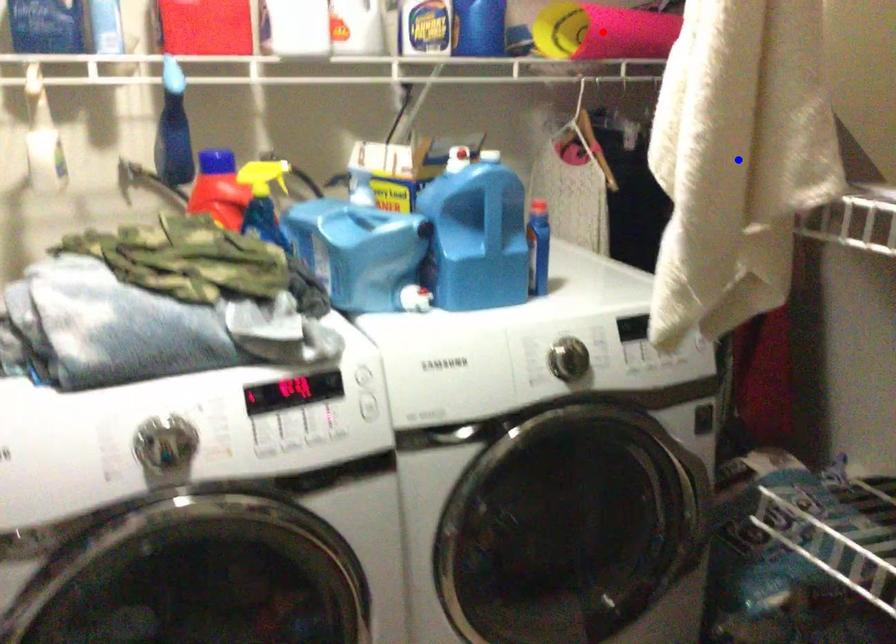
Question: In the image, two points are highlighted. Which point is nearer to the camera? Reply with the corresponding letter.

Choices:
 (A) blue point
 (B) red point

Answer: (A)